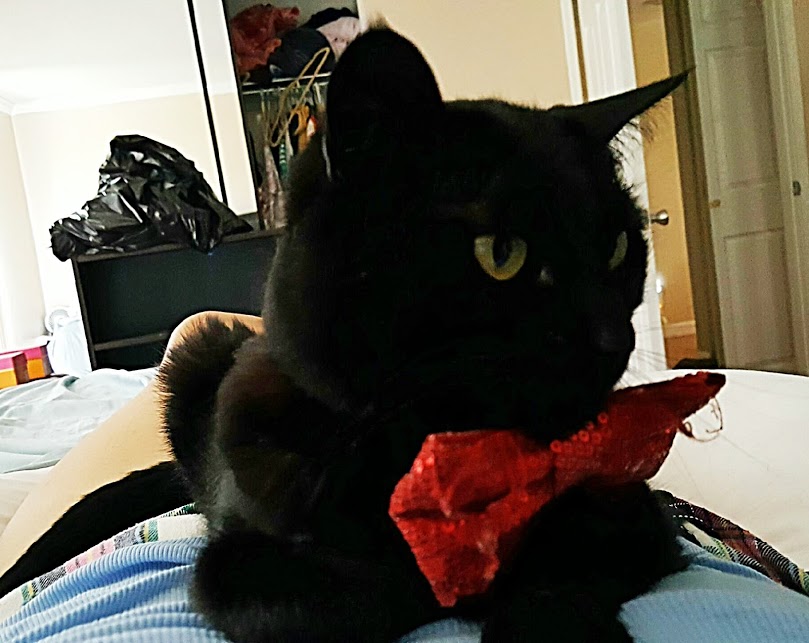
Locate an element on the screen. This screenshot has height=643, width=809. closet is located at coordinates (298, 51).